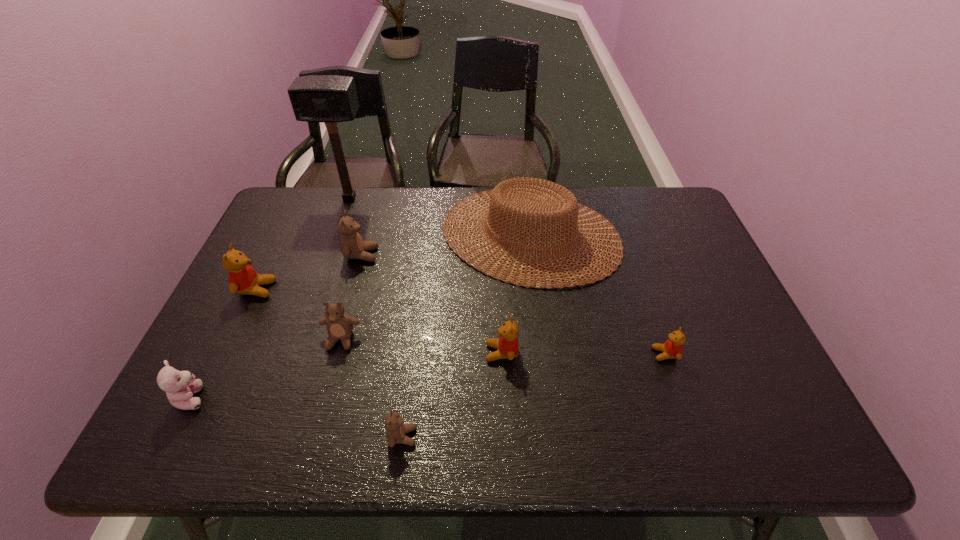
Locate an element on the screen. The image size is (960, 540). free space located 0.140m on the front-facing side of the sixth teddy bear from left to right is located at coordinates (429, 353).

This screenshot has width=960, height=540. I want to click on free region located on the front-facing side of the sixth teddy bear from left to right, so click(x=364, y=353).

Locate an element on the screen. This screenshot has height=540, width=960. vacant space situated 0.080m on the front-facing side of the second biggest brown teddy bear is located at coordinates (330, 380).

I want to click on vacant space located at the face of the pink teddy bear, so click(x=287, y=397).

Find the location of `free space located on the front-facing side of the rightmost teddy bear`. free space located on the front-facing side of the rightmost teddy bear is located at coordinates (535, 354).

In order to click on free spot located on the front-facing side of the rightmost teddy bear in this screenshot , I will do `click(511, 354)`.

Where is `free space located 0.200m on the front-facing side of the rightmost teddy bear`? Image resolution: width=960 pixels, height=540 pixels. free space located 0.200m on the front-facing side of the rightmost teddy bear is located at coordinates (572, 354).

What are the coordinates of `vacant region located 0.060m on the front-facing side of the sixth object from left to right` in the screenshot? It's located at (444, 436).

Locate an element on the screen. This screenshot has width=960, height=540. mallet at the far edge is located at coordinates (330, 99).

This screenshot has height=540, width=960. Find the location of `sunhat that is at the far edge`. sunhat that is at the far edge is located at coordinates (552, 205).